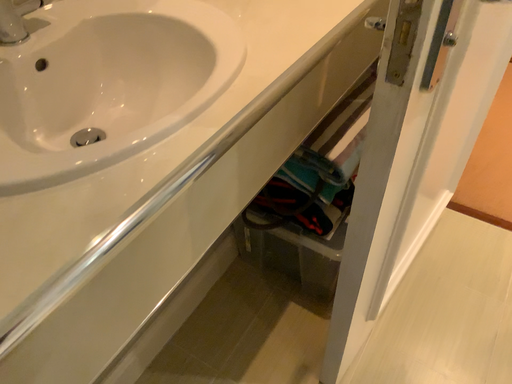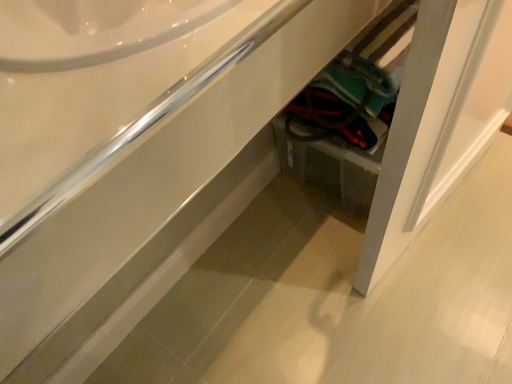
Question: Which way did the camera rotate in the video?

Choices:
 (A) rotated downward
 (B) rotated upward

Answer: (A)